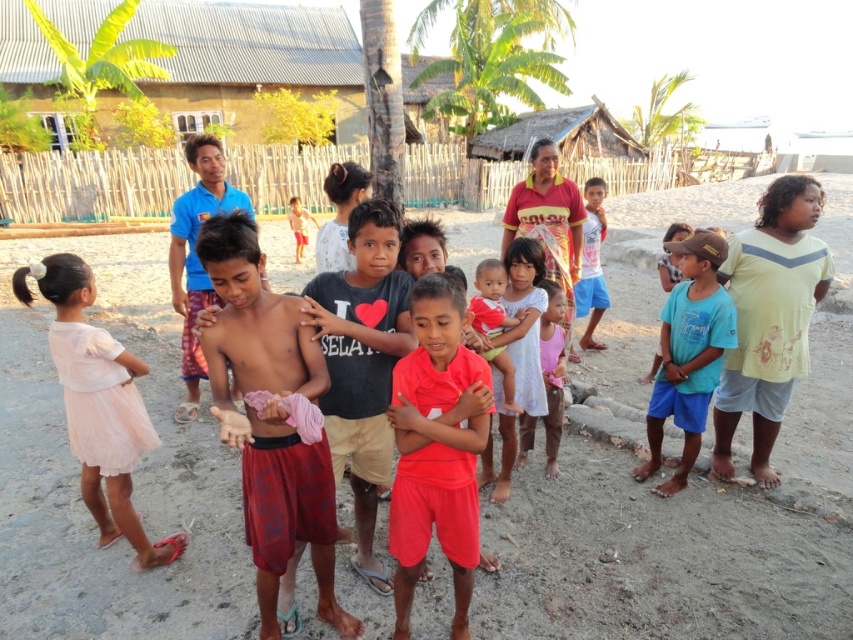
Does matte red shorts at right have a smaller size compared to pink tulle dress at lower left?

Incorrect, matte red shorts at right is not smaller in size than pink tulle dress at lower left.

Is point (795, 289) positioned after point (102, 346)?

Yes, it is.

Is point (793, 304) in front of point (126, 452)?

No, it is behind (126, 452).

The image size is (853, 640). In order to click on matte red shorts at right in this screenshot , I will do `click(769, 317)`.

Is point (270, 321) behind point (697, 362)?

No.

Who is more distant from viewer, [213,216] or [700,349]?

Point [700,349]

This screenshot has width=853, height=640. What are the coordinates of `reddish-brown fabric shorts at center` in the screenshot? It's located at (270, 419).

Between point (647, 636) and point (540, 349), which one is positioned behind?

The point (540, 349) is behind.

At what (x,y) coordinates should I click in order to perform the action: click on brown sandy ground at center. Please return your answer as a coordinate pair (x, y). Looking at the image, I should click on (132, 474).

Between point (202, 602) and point (556, 444), which one is positioned in front?

Positioned in front is point (202, 602).

Identify the location of brown sandy ground at center. The width and height of the screenshot is (853, 640). (132, 474).